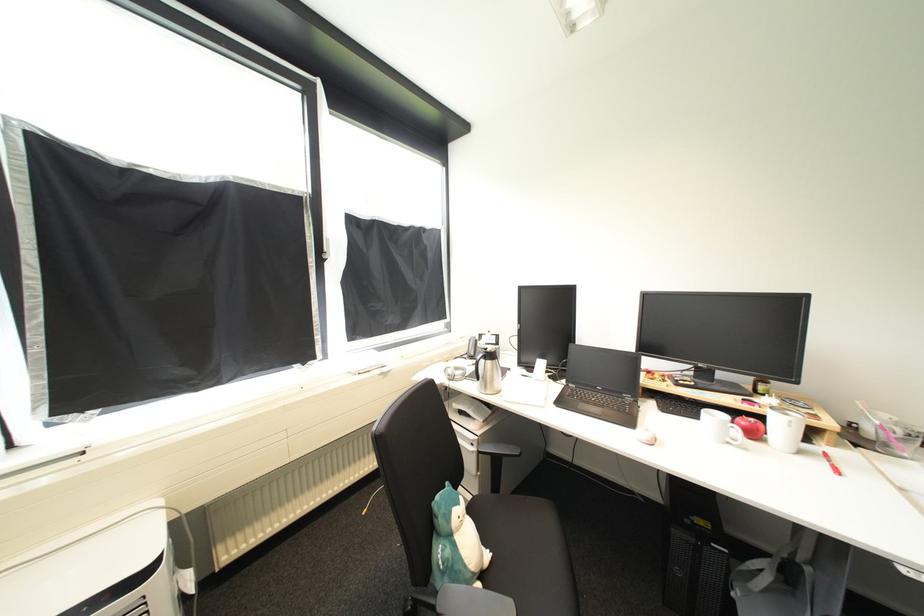
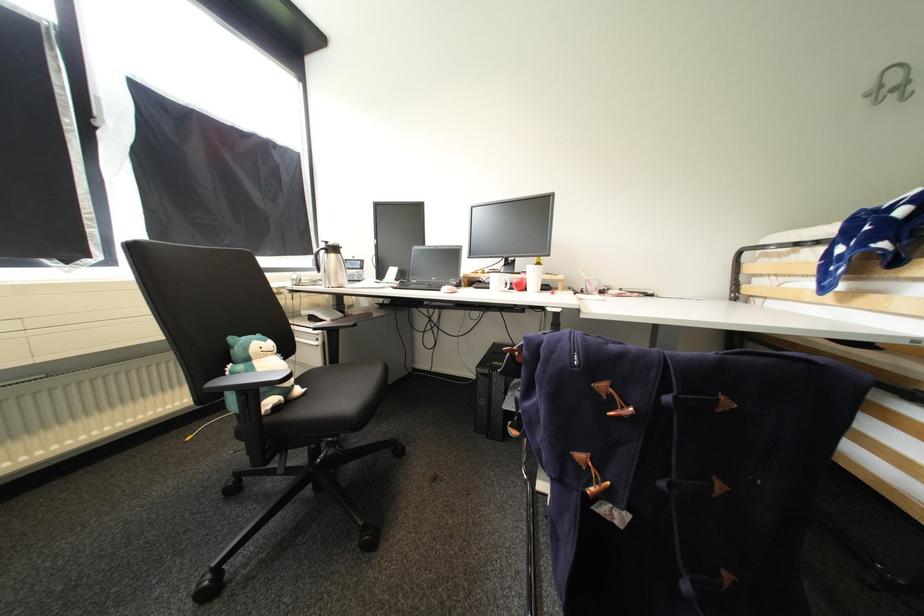
The images are taken continuously from a first-person perspective. In which direction are you moving?

The cameraman walked toward right, backward.